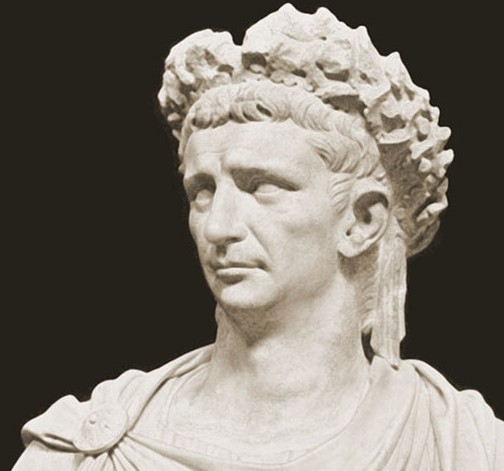
Locate an element on the screen. The height and width of the screenshot is (471, 504). robe is located at coordinates (129, 390).